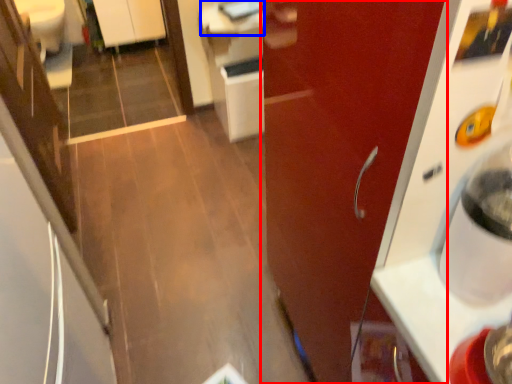
Question: Which point is closer to the camera, door (highlighted by a red box) or counter top (highlighted by a blue box)?

Choices:
 (A) door
 (B) counter top

Answer: (A)